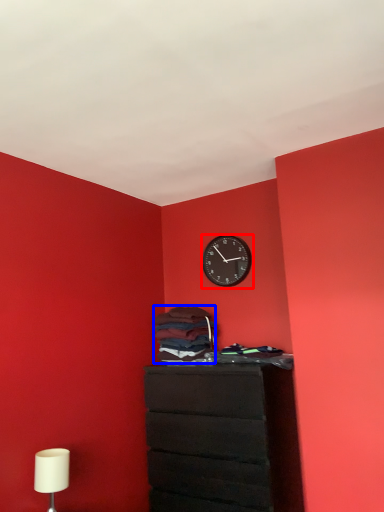
Question: Which of the following is the closest to the observer, wall clock (highlighted by a red box) or laundry (highlighted by a blue box)?

Choices:
 (A) wall clock
 (B) laundry

Answer: (B)